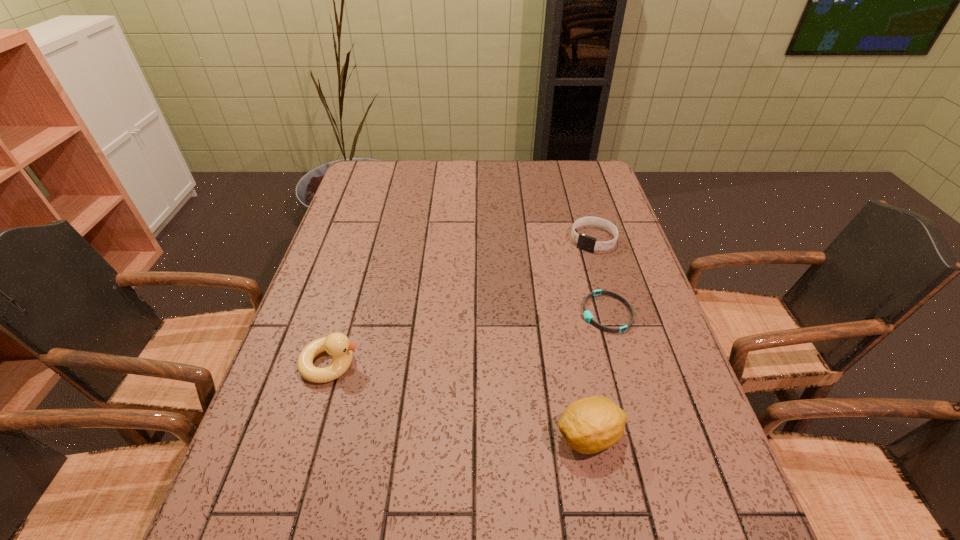
At what (x,y) coordinates should I click in order to perform the action: click on free region located 0.390m at the stem end of the nearest object. Please return your answer as a coordinate pair (x, y). This screenshot has height=540, width=960. Looking at the image, I should click on (359, 436).

This screenshot has height=540, width=960. I want to click on blank area located 0.140m on the buckle of the shortest object, so click(540, 343).

Image resolution: width=960 pixels, height=540 pixels. What are the coordinates of `free space located on the buckle of the shortest object` in the screenshot? It's located at (496, 362).

The width and height of the screenshot is (960, 540). What are the coordinates of `vacant region located 0.090m on the buckle of the shortest object` in the screenshot? It's located at (557, 335).

What are the coordinates of `vacant space located 0.340m on the outer surface of the third tallest object` in the screenshot? It's located at (531, 325).

The image size is (960, 540). What are the coordinates of `vacant area situated on the outer surface of the third tallest object` in the screenshot? It's located at (569, 272).

Identify the location of vacant region located on the outer surface of the third tallest object. Image resolution: width=960 pixels, height=540 pixels. (535, 320).

The height and width of the screenshot is (540, 960). I want to click on object at the near edge, so click(589, 425).

This screenshot has height=540, width=960. I want to click on object positioned at the left edge, so click(x=337, y=345).

In the image, there is a desktop. Identify the location of vacant space at the far edge. This screenshot has height=540, width=960. (408, 177).